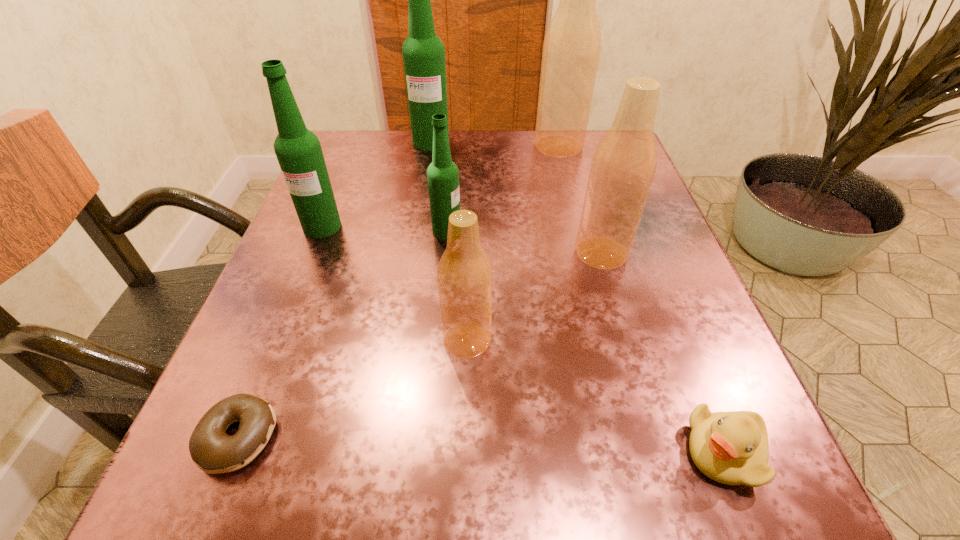
I want to click on beer bottle that is the fourth closest to the second nearest tan beer bottle, so click(x=423, y=52).

Choose which green beer bottle is the second nearest neighbor to the second shortest object. Please provide its 2D coordinates. Your answer should be formatted as a tuple, i.e. [(x, y)], where the tuple contains the x and y coordinates of a point satisfying the conditions above.

[(298, 150)]

The image size is (960, 540). What are the coordinates of `green beer bottle that is the third closest to the second nearest tan beer bottle` in the screenshot? It's located at (298, 150).

At what (x,y) coordinates should I click in order to perform the action: click on the third closest tan beer bottle to the biggest green beer bottle. Please return your answer as a coordinate pair (x, y). Looking at the image, I should click on (464, 275).

Find the location of a particular element. tan beer bottle that can be found as the closest to the duckling is located at coordinates (464, 275).

You are a GUI agent. You are given a task and a screenshot of the screen. Output one action in this format:
    pyautogui.click(x=<x>, y=<y>)
    Task: Click on the vacant space that satisfies the following two spatial constraints: 1. on the label of the nearest tan beer bottle; 2. on the right side of the leftmost beer bottle
    This screenshot has height=540, width=960.
    Given the screenshot: What is the action you would take?
    pyautogui.click(x=276, y=340)

Locate an element on the screen. Image resolution: width=960 pixels, height=540 pixels. free point that satisfies the following two spatial constraints: 1. on the label of the biggest green beer bottle; 2. on the left side of the farthest tan beer bottle is located at coordinates [x=430, y=146].

Locate an element on the screen. The image size is (960, 540). free space that satisfies the following two spatial constraints: 1. on the label of the farthest green beer bottle; 2. on the left side of the biggest tan beer bottle is located at coordinates (430, 146).

Where is `free space that satisfies the following two spatial constraints: 1. on the back side of the doughnut; 2. on the left side of the second nearest tan beer bottle`? This screenshot has height=540, width=960. free space that satisfies the following two spatial constraints: 1. on the back side of the doughnut; 2. on the left side of the second nearest tan beer bottle is located at coordinates (312, 253).

This screenshot has height=540, width=960. I want to click on vacant space that satisfies the following two spatial constraints: 1. on the label of the leftmost tan beer bottle; 2. on the right side of the smallest green beer bottle, so click(438, 340).